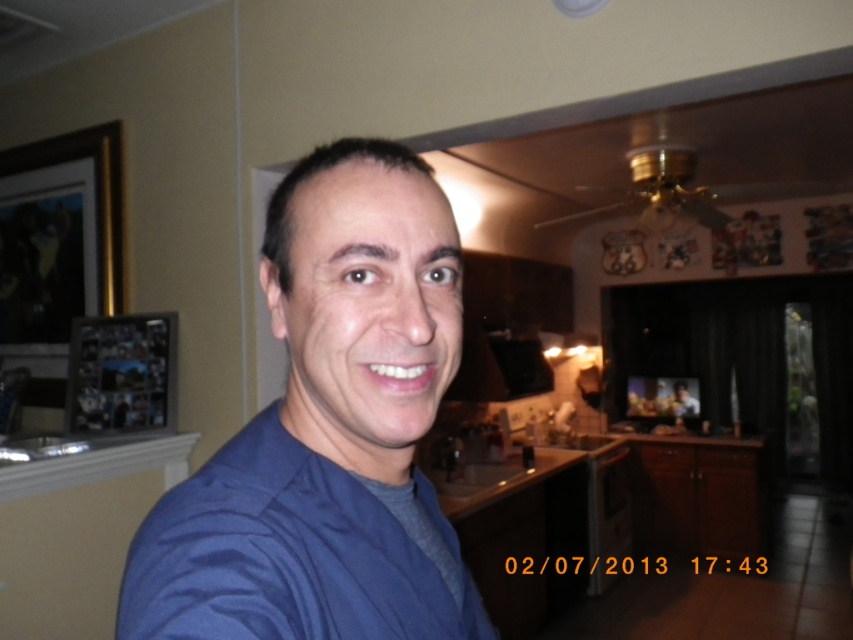
You are arranging items on a shelf and need to place the blue fabric shirt at center and the wooden photo frame at left. According to the image, which item should be placed to the left of the other?

The blue fabric shirt at center is positioned on the right side of wooden photo frame at left, so the wooden photo frame at left should be placed to the left of the blue fabric shirt at center.

You are trying to decide whether the blue fabric shirt at center can be folded and placed inside the wooden photo frame at left. Based on their sizes, is this possible?

The blue fabric shirt at center is thinner than the wooden photo frame at left, so it might be possible to fold the blue fabric shirt at center and place it inside the wooden photo frame at left if the frame has enough space. However, the exact feasibility depends on the frame dimensions not mentioned here.

You are trying to determine which blue shirt is closer to you in the selfie. You see the blue fabric shirt at center and the blue smooth shirt at center. Which one is nearer?

The blue fabric shirt at center is closer to the viewer than the blue smooth shirt at center.